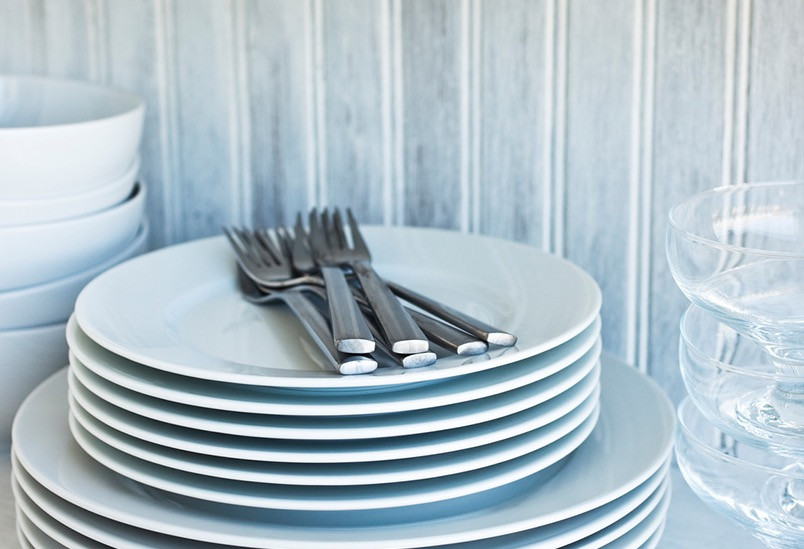
At what (x,y) coordinates should I click in order to perform the action: click on large plate edges. Please return your answer as a coordinate pair (x, y). The width and height of the screenshot is (804, 549). Looking at the image, I should click on (658, 539), (642, 536), (617, 535), (593, 533), (560, 519).